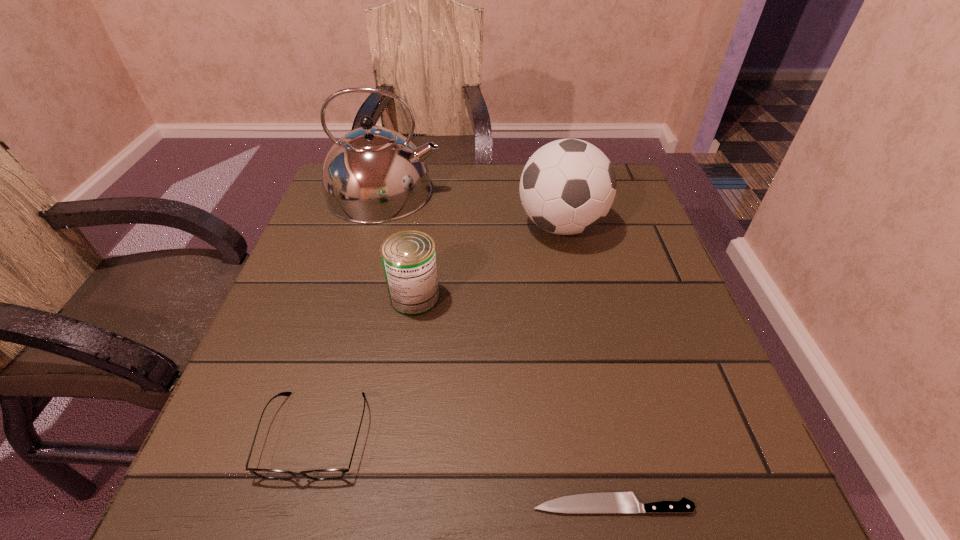
The image size is (960, 540). In the image, there is a desktop. Identify the location of free region at the near right corner. (690, 492).

Find the location of a particular element. Image resolution: width=960 pixels, height=540 pixels. free spot between the shortest object and the kettle is located at coordinates (498, 348).

Find the location of `free point between the second nearest object and the soccer ball`. free point between the second nearest object and the soccer ball is located at coordinates click(438, 330).

This screenshot has width=960, height=540. I want to click on free point between the soccer ball and the second shortest object, so click(x=438, y=330).

This screenshot has width=960, height=540. I want to click on empty space that is in between the tallest object and the soccer ball, so click(472, 209).

Find the location of a particular element. This screenshot has width=960, height=540. vacant space that is in between the second tallest object and the tallest object is located at coordinates (472, 209).

Locate an element on the screen. vacant region between the kettle and the second tallest object is located at coordinates (472, 209).

At what (x,y) coordinates should I click in order to perform the action: click on vacant space that's between the nearest object and the soccer ball. Please return your answer as a coordinate pair (x, y). This screenshot has width=960, height=540. Looking at the image, I should click on (587, 365).

Identify the location of vacant space that is in between the nearest object and the soccer ball. The height and width of the screenshot is (540, 960). (587, 365).

In order to click on blank region between the soccer ball and the spectacles in this screenshot , I will do `click(438, 330)`.